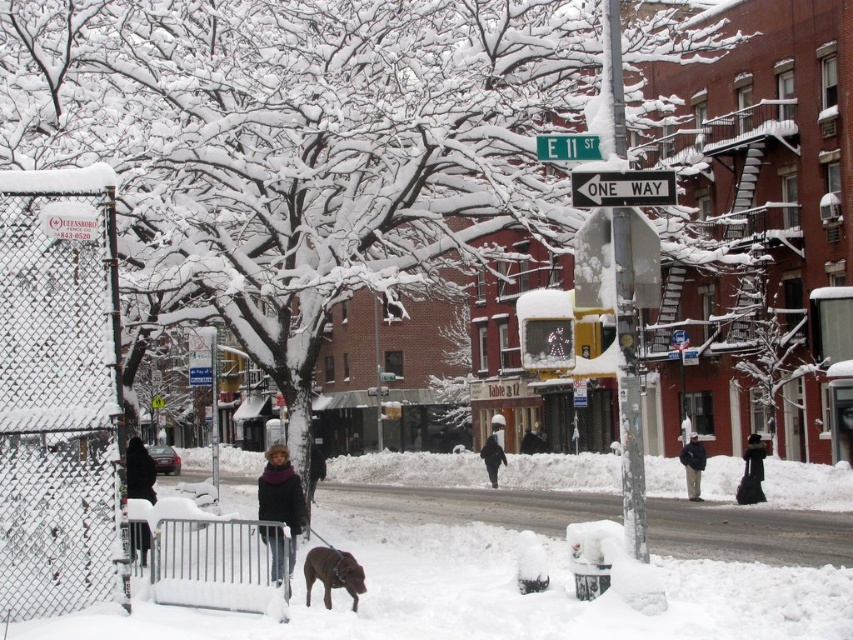
Question: Does brown fur dog at lower center come behind dark blue jacket at center?

Choices:
 (A) yes
 (B) no

Answer: (B)

Question: Which of these objects is positioned closest to the black velvet dress at lower right?

Choices:
 (A) dark brown leather jacket at center
 (B) snow-covered metal pole at center
 (C) brown fur dog at lower center
 (D) green metallic street sign at upper center

Answer: (B)

Question: Considering the relative positions of white snow at road center and green metallic street sign at upper center in the image provided, where is white snow at road center located with respect to green metallic street sign at upper center?

Choices:
 (A) below
 (B) above

Answer: (A)

Question: Among these objects, which one is farthest from the camera?

Choices:
 (A) white chain-link fence at left
 (B) black wool coat at lower left

Answer: (B)

Question: Which is farther from the brown fur dog at lower center?

Choices:
 (A) dark blue jacket at center
 (B) white chain-link fence at left

Answer: (A)

Question: Is brown fur dog at lower center wider than black velvet dress at lower right?

Choices:
 (A) no
 (B) yes

Answer: (A)